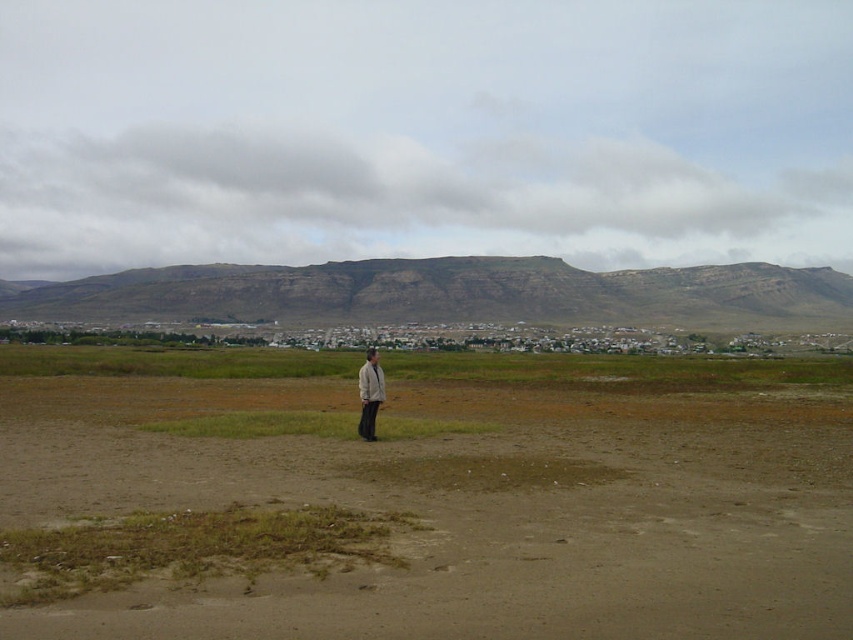
Looking at this image, you are a hiker planning to cross the brown sandy dirt field at center and the brown rocky mountain at upper center. Which path would be wider for your journey?

The brown rocky mountain at upper center is wider than the brown sandy dirt field at center, so the path through the brown rocky mountain at upper center would be wider for your journey.

You are a hiker planning to cross the brown sandy dirt field at center and the brown rocky mountain at upper center. Which terrain should you choose if you want to reach the town in the midground more quickly?

The brown sandy dirt field at center is positioned on the left side of brown rocky mountain at upper center, so choosing the brown sandy dirt field at center would provide a quicker path to the town in the midground since it is closer to the town compared to the mountain.